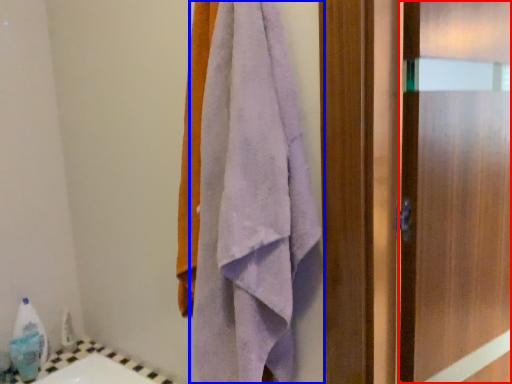
Question: Which of the following is the farthest to the observer, screen door (highlighted by a red box) or towel (highlighted by a blue box)?

Choices:
 (A) screen door
 (B) towel

Answer: (A)